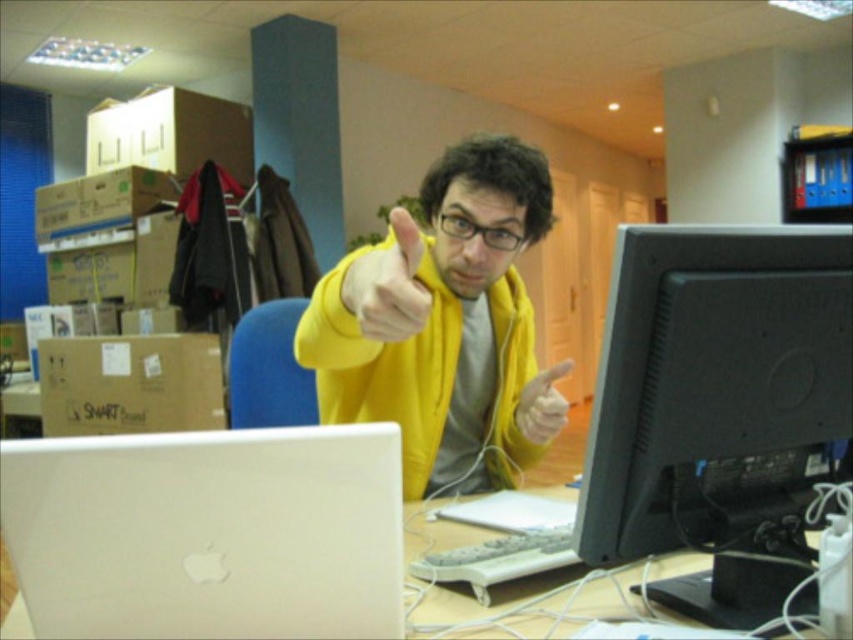
You are standing in front of the desk and want to reach the point marked at coordinates point (648, 392). If your hand can extend 75 centimeters forward, will you be able to reach it?

The point marked at coordinates point (648, 392) is 80.87 centimeters away from the viewer. Since your hand can only extend 75 centimeters, you will not be able to reach it.

You are setting up a new webcam for a video call and need to position it between the black matte monitor at right and the satin white laptop at lower left. Based on their positions, which object should the webcam be placed closer to in order to be centered between them?

The black matte monitor at right is above the satin white laptop at lower left, so to center the webcam between them, it should be placed closer to the satin white laptop at lower left since the monitor is higher up.